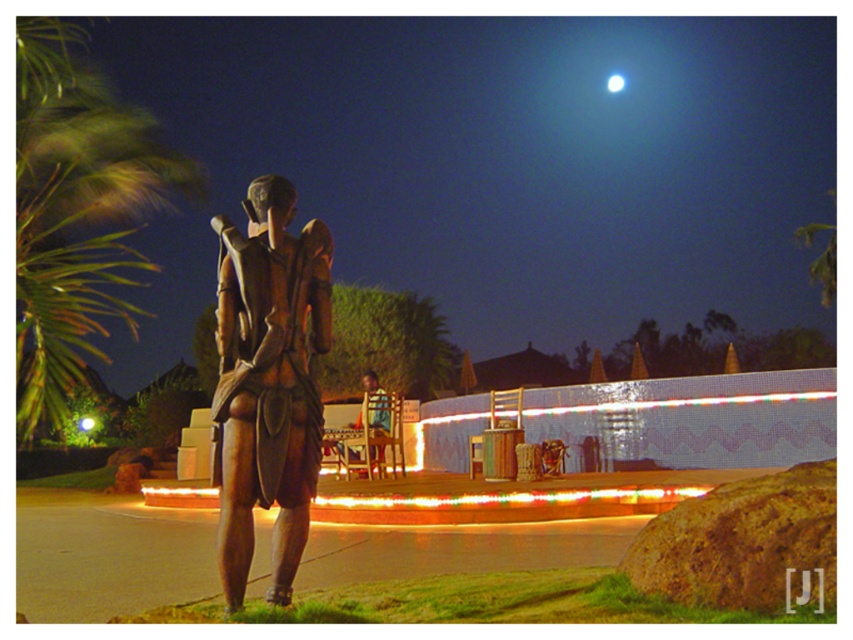
You are standing in the nighttime scene and want to take a closer look at the bronze statue at center. If your maximum comfortable viewing distance is 3 meters, can you comfortably view the statue from your current position?

The bronze statue at center is 2.81 meters away from the viewer, which is within the comfortable viewing distance of 3 meters. Therefore, you can comfortably view the statue from your current position.